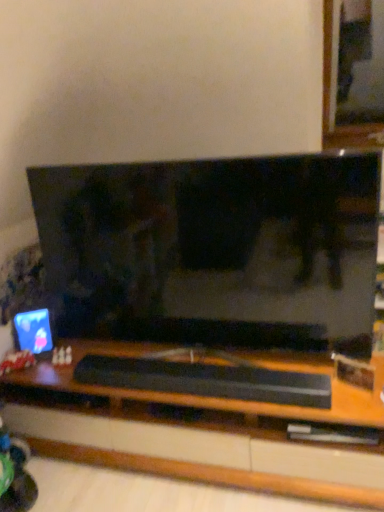
Question: Can you confirm if black matte soundbar at center is taller than black glossy television at center?

Choices:
 (A) no
 (B) yes

Answer: (A)

Question: Is black matte soundbar at center closer to camera compared to black glossy television at center?

Choices:
 (A) yes
 (B) no

Answer: (B)

Question: Is black matte soundbar at center at the left side of black glossy television at center?

Choices:
 (A) no
 (B) yes

Answer: (B)

Question: Is black glossy television at center at the back of black matte soundbar at center?

Choices:
 (A) yes
 (B) no

Answer: (A)

Question: Considering the relative sizes of black matte soundbar at center and black glossy television at center in the image provided, is black matte soundbar at center thinner than black glossy television at center?

Choices:
 (A) no
 (B) yes

Answer: (A)

Question: Does black matte soundbar at center turn towards black glossy television at center?

Choices:
 (A) no
 (B) yes

Answer: (A)

Question: From the image's perspective, is matte plastic computer monitor at left located beneath plush fabric teddy bear at lower left?

Choices:
 (A) no
 (B) yes

Answer: (A)

Question: Is matte plastic computer monitor at left at the left side of plush fabric teddy bear at lower left?

Choices:
 (A) no
 (B) yes

Answer: (A)

Question: Is matte plastic computer monitor at left bigger than plush fabric teddy bear at lower left?

Choices:
 (A) no
 (B) yes

Answer: (B)

Question: Does matte plastic computer monitor at left lie behind plush fabric teddy bear at lower left?

Choices:
 (A) no
 (B) yes

Answer: (B)

Question: Can you confirm if matte plastic computer monitor at left is positioned to the right of plush fabric teddy bear at lower left?

Choices:
 (A) yes
 (B) no

Answer: (A)

Question: Is plush fabric teddy bear at lower left at the back of matte plastic computer monitor at left?

Choices:
 (A) no
 (B) yes

Answer: (A)

Question: From a real-world perspective, is plush fabric teddy bear at lower left under matte plastic computer monitor at left?

Choices:
 (A) yes
 (B) no

Answer: (A)